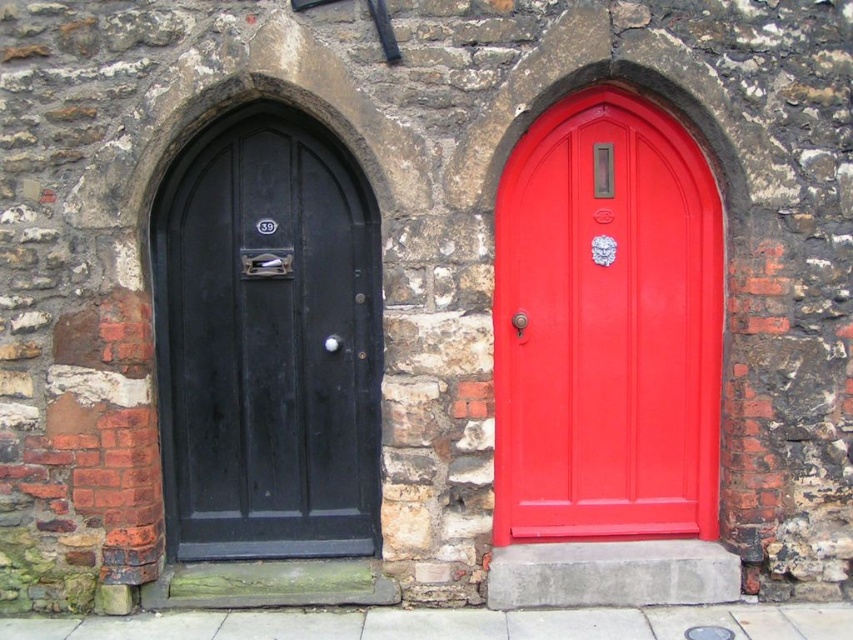
Question: Does glossy wood door at upper center come in front of matte black door at left?

Choices:
 (A) yes
 (B) no

Answer: (A)

Question: Is glossy wood door at upper center bigger than matte black door at left?

Choices:
 (A) yes
 (B) no

Answer: (B)

Question: Which point is closer to the camera?

Choices:
 (A) (178, 360)
 (B) (628, 173)

Answer: (B)

Question: Does glossy wood door at upper center come behind matte black door at left?

Choices:
 (A) yes
 (B) no

Answer: (B)

Question: Which of the following is the closest to the observer?

Choices:
 (A) matte black door at left
 (B) glossy wood door at upper center

Answer: (B)